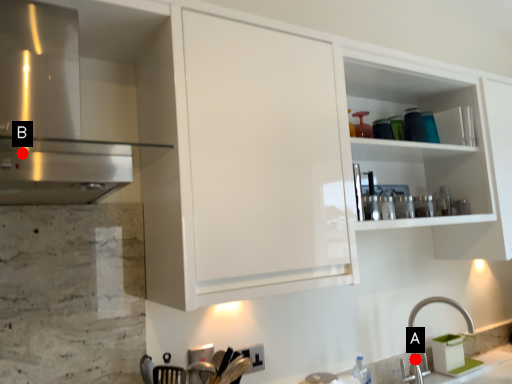
Question: Two points are circled on the image, labeled by A and B beside each circle. Which point is farther from the camera taking this photo?

Choices:
 (A) A is further
 (B) B is further

Answer: (A)